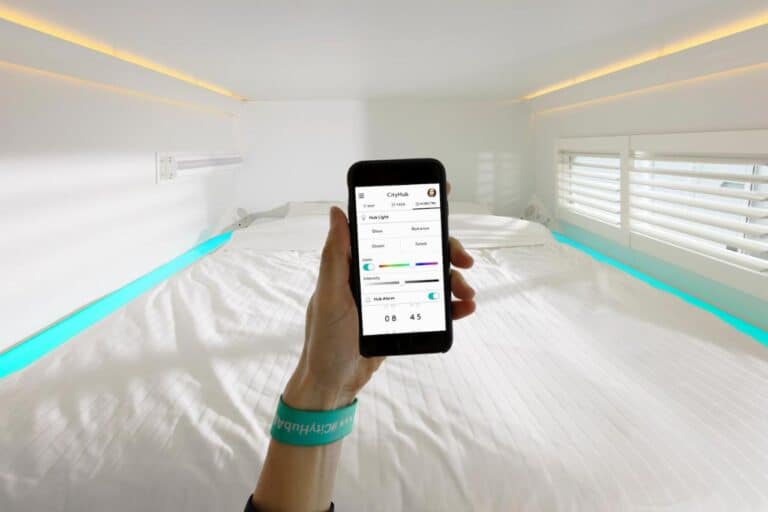
What are the coordinates of `window` in the screenshot? It's located at (697, 196), (601, 191).